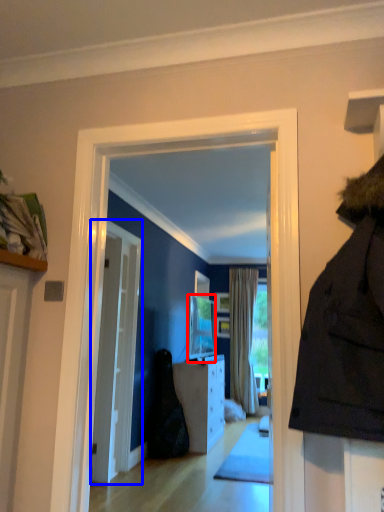
Question: Among these objects, which one is nearest to the camera, television (highlighted by a red box) or door (highlighted by a blue box)?

Choices:
 (A) television
 (B) door

Answer: (B)